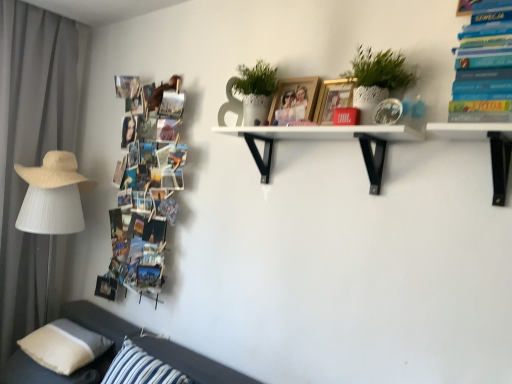
Question: Can you confirm if beige straw hat at left is taller than hardcover book at upper right, the 1th book viewed from the front?

Choices:
 (A) yes
 (B) no

Answer: (B)

Question: Are beige straw hat at left and hardcover book at upper right, arranged as the 2th book when viewed from the left, beside each other?

Choices:
 (A) no
 (B) yes

Answer: (A)

Question: Are beige straw hat at left and hardcover book at upper right, the 1th book viewed from the front, located far from each other?

Choices:
 (A) yes
 (B) no

Answer: (A)

Question: Is beige straw hat at left looking in the opposite direction of hardcover book at upper right, the 1th book viewed from the front?

Choices:
 (A) no
 (B) yes

Answer: (A)

Question: Is beige straw hat at left oriented towards hardcover book at upper right, the 1th book viewed from the front?

Choices:
 (A) no
 (B) yes

Answer: (A)

Question: Is gray fabric curtain at left in front of or behind dark gray fabric couch at lower left in the image?

Choices:
 (A) front
 (B) behind

Answer: (B)

Question: Does point (19, 286) appear closer or farther from the camera than point (10, 362)?

Choices:
 (A) farther
 (B) closer

Answer: (A)

Question: In terms of height, does gray fabric curtain at left look taller or shorter compared to dark gray fabric couch at lower left?

Choices:
 (A) tall
 (B) short

Answer: (A)

Question: Choose the correct answer: Is gray fabric curtain at left inside dark gray fabric couch at lower left or outside it?

Choices:
 (A) outside
 (B) inside

Answer: (A)

Question: From the image's perspective, relative to beige fabric pillow at lower left, which ranks as the 1th pillow in left-to-right order, is metallic gold picture frame at upper center, placed as the second picture frame when sorted from back to front, above or below?

Choices:
 (A) below
 (B) above

Answer: (B)

Question: Is metallic gold picture frame at upper center, placed as the second picture frame when sorted from back to front, in front of or behind beige fabric pillow at lower left, which ranks as the 1th pillow in left-to-right order, in the image?

Choices:
 (A) behind
 (B) front

Answer: (B)

Question: Is metallic gold picture frame at upper center, the 1th picture frame when ordered from front to back, inside the boundaries of beige fabric pillow at lower left, which ranks as the 1th pillow in left-to-right order, or outside?

Choices:
 (A) inside
 (B) outside

Answer: (B)

Question: Is metallic gold picture frame at upper center, placed as the second picture frame when sorted from back to front, taller or shorter than beige fabric pillow at lower left, which ranks as the 1th pillow in left-to-right order?

Choices:
 (A) short
 (B) tall

Answer: (B)

Question: Is wooden photo frame at upper center, acting as the second picture frame starting from the front, taller or shorter than white matte shelf at center?

Choices:
 (A) short
 (B) tall

Answer: (A)

Question: From a real-world perspective, is wooden photo frame at upper center, acting as the first picture frame starting from the back, positioned above or below white matte shelf at center?

Choices:
 (A) above
 (B) below

Answer: (A)